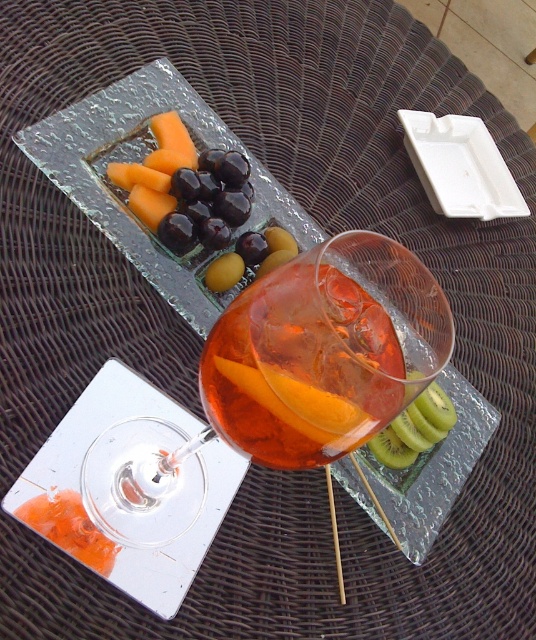
Question: Which object is positioned farthest from the green kiwi at lower right?

Choices:
 (A) yellow matte kiwi at center
 (B) translucent glass drink at center
 (C) translucent glass wine glass at center
 (D) green matte kiwi at lower right

Answer: (A)

Question: Estimate the real-world distances between objects in this image. Which object is farther from the yellow matte kiwi at center?

Choices:
 (A) translucent glass wine glass at center
 (B) green matte kiwi at lower right
 (C) translucent glass drink at center

Answer: (B)

Question: Among these points, which one is farthest from the camera?

Choices:
 (A) (433, 436)
 (B) (233, 264)

Answer: (A)

Question: Does green kiwi at lower right appear on the right side of yellow matte kiwi at center?

Choices:
 (A) yes
 (B) no

Answer: (A)

Question: Does green kiwi at lower right have a greater width compared to yellow matte kiwi at center?

Choices:
 (A) no
 (B) yes

Answer: (B)

Question: Is translucent glass wine glass at center in front of green matte kiwi at lower right?

Choices:
 (A) yes
 (B) no

Answer: (A)